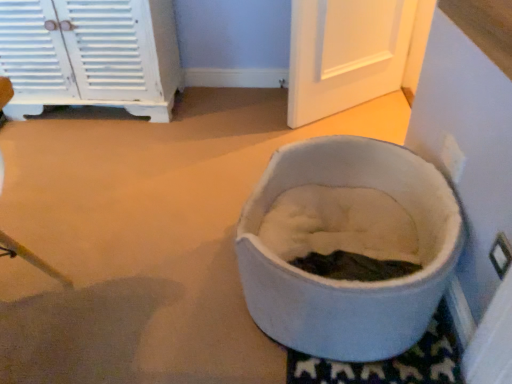
Question: In terms of height, does white painted wood cabinet at upper left look taller or shorter compared to white soft pet bed at center?

Choices:
 (A) tall
 (B) short

Answer: (A)

Question: Considering the relative positions of white painted wood cabinet at upper left and white soft pet bed at center in the image provided, is white painted wood cabinet at upper left to the left or to the right of white soft pet bed at center?

Choices:
 (A) left
 (B) right

Answer: (A)

Question: Considering the positions of white painted wood cabinet at upper left and white soft pet bed at center in the image, is white painted wood cabinet at upper left bigger or smaller than white soft pet bed at center?

Choices:
 (A) big
 (B) small

Answer: (A)

Question: Visually, is white soft pet bed at center positioned to the left or to the right of white painted wood cabinet at upper left?

Choices:
 (A) right
 (B) left

Answer: (A)

Question: From a real-world perspective, is white soft pet bed at center above or below white painted wood cabinet at upper left?

Choices:
 (A) above
 (B) below

Answer: (B)

Question: Considering the positions of white soft pet bed at center and white painted wood cabinet at upper left in the image, is white soft pet bed at center wider or thinner than white painted wood cabinet at upper left?

Choices:
 (A) wide
 (B) thin

Answer: (A)

Question: Is white soft pet bed at center taller or shorter than white painted wood cabinet at upper left?

Choices:
 (A) tall
 (B) short

Answer: (B)